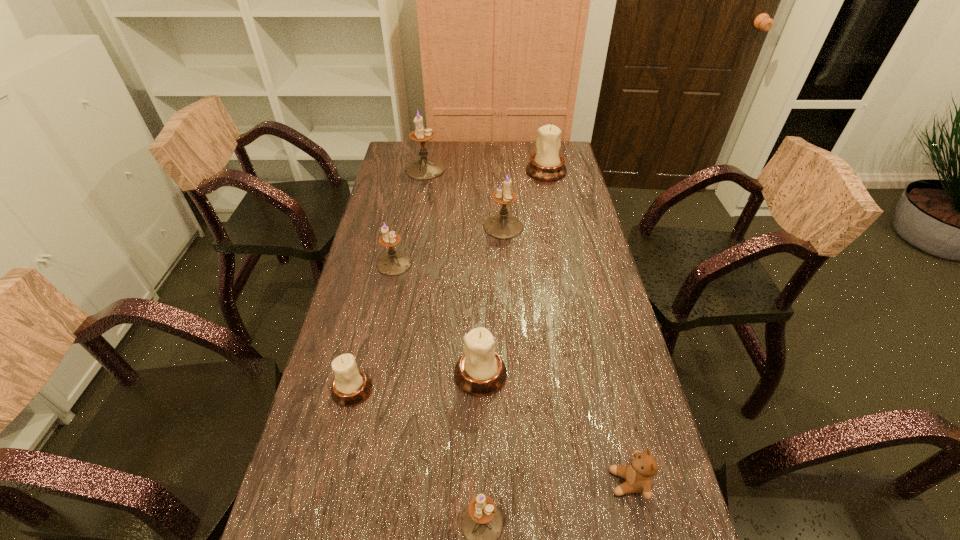
Identify the location of candle holder present at the right edge. This screenshot has height=540, width=960. (546, 165).

Find the location of `teddy bear that is at the right edge`. teddy bear that is at the right edge is located at coordinates (639, 473).

The image size is (960, 540). In order to click on object positioned at the far left corner in this screenshot , I will do `click(425, 168)`.

Where is `object at the far right corner`? The height and width of the screenshot is (540, 960). object at the far right corner is located at coordinates (546, 165).

Identify the location of vacant space at the far edge of the desktop. (448, 156).

The width and height of the screenshot is (960, 540). Find the location of `vacant space at the left edge of the desktop`. vacant space at the left edge of the desktop is located at coordinates click(390, 181).

At what (x,y) coordinates should I click in order to perform the action: click on free space at the right edge. Please return your answer as a coordinate pair (x, y). Looking at the image, I should click on (588, 235).

I want to click on free space between the tallest object and the farthest white candle holder, so click(x=486, y=170).

You are a GUI agent. You are given a task and a screenshot of the screen. Output one action in this format:
    pyautogui.click(x=<x>, y=<y>)
    Task: Click on the empty space between the tallest candle holder and the teddy bear
    
    Given the screenshot: What is the action you would take?
    pyautogui.click(x=527, y=326)

You are a GUI agent. You are given a task and a screenshot of the screen. Output one action in this format:
    pyautogui.click(x=<x>, y=<y>)
    Task: Click on the free space between the biggest purple candle holder and the third farthest object
    This screenshot has width=960, height=540.
    Given the screenshot: What is the action you would take?
    pyautogui.click(x=465, y=198)